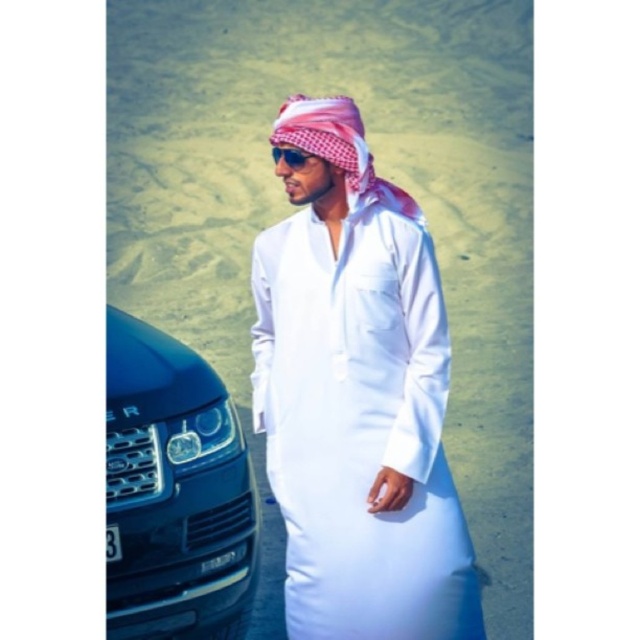
You are a photographer trying to capture the shiny blue car at left and the sunglasses at center in a single frame. Based on their sizes, which object should you focus on first to ensure both fit in the photo?

The shiny blue car at left is larger in size than the sunglasses at center, so you should focus on the shiny blue car at left first to ensure both fit in the photo.

Based on the photo, you are a photographer trying to capture the person in the image. Since the white cotton thobe at center and sunglasses at center are both in focus, which object would appear bigger in your photo?

The white cotton thobe at center is larger in size than sunglasses at center, so it would appear bigger in the photo.

You are a photographer trying to capture the shiny blue car at left in your shot. You are currently positioned at the point with coordinates point (173, 492). Can you see the shiny blue car at left from your current position?

Yes, the point (173, 492) corresponds to the shiny blue car at left, so you are directly at its location and can see it.